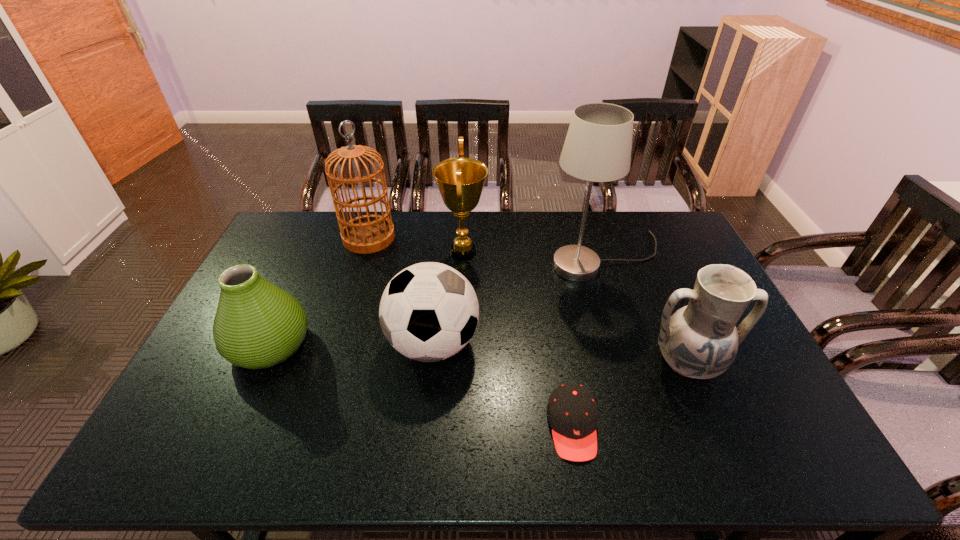
Where is `the tallest object`? This screenshot has width=960, height=540. the tallest object is located at coordinates (597, 148).

Locate an element on the screen. This screenshot has width=960, height=540. birdcage is located at coordinates (365, 234).

The width and height of the screenshot is (960, 540). I want to click on award, so click(460, 180).

Find the location of `pitcher`. pitcher is located at coordinates (700, 340).

The width and height of the screenshot is (960, 540). Find the location of `vase`. vase is located at coordinates (257, 325).

The image size is (960, 540). Identify the location of soccer ball. (429, 311).

Identify the location of cap. (572, 412).

Where is `the nearest object`? the nearest object is located at coordinates (572, 412).

Where is `free region located on the back of the tallest object`? free region located on the back of the tallest object is located at coordinates (591, 219).

Find the location of a particular element. vacant area situated 0.400m on the front of the birdcage is located at coordinates (337, 341).